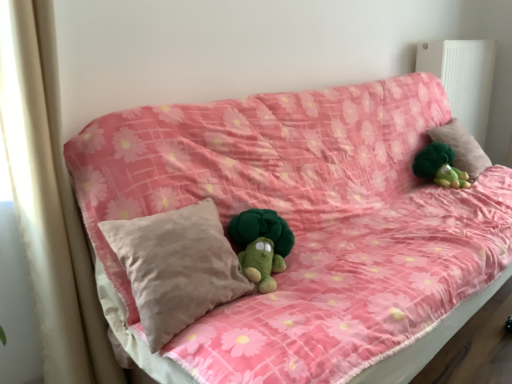
Question: Based on their positions, is white plastic radiator at upper right located to the left or right of beige soft pillow at center, which is counted as the first pillow, starting from the front?

Choices:
 (A) right
 (B) left

Answer: (A)

Question: Considering the positions of white plastic radiator at upper right and beige soft pillow at center, which ranks as the 1th pillow in bottom-to-top order, in the image, is white plastic radiator at upper right bigger or smaller than beige soft pillow at center, which ranks as the 1th pillow in bottom-to-top order,?

Choices:
 (A) big
 (B) small

Answer: (A)

Question: Based on their relative distances, which object is farther from the beige fabric curtain at left?

Choices:
 (A) pink fabric couch at center
 (B) beige cotton pillow at upper right, which ranks as the 2th pillow in bottom-to-top order
 (C) white plastic radiator at upper right
 (D) green plush toy at upper right
 (E) beige soft pillow at center, which ranks as the 1th pillow in bottom-to-top order

Answer: (C)

Question: Which object is the closest to the pink fabric couch at center?

Choices:
 (A) beige fabric curtain at left
 (B) green plush toy at upper right
 (C) white plastic radiator at upper right
 (D) beige cotton pillow at upper right, which ranks as the 2th pillow in bottom-to-top order
 (E) beige soft pillow at center, placed as the second pillow when sorted from back to front

Answer: (E)